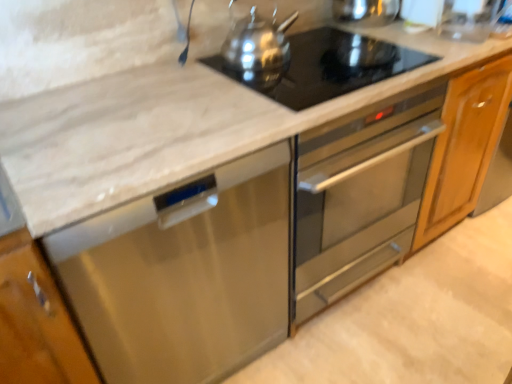
Question: From the image's perspective, is black glass cooktop at upper center located above stainless steel dishwasher at lower left?

Choices:
 (A) yes
 (B) no

Answer: (A)

Question: Can you confirm if black glass cooktop at upper center is bigger than stainless steel dishwasher at lower left?

Choices:
 (A) no
 (B) yes

Answer: (A)

Question: Is black glass cooktop at upper center further to the viewer compared to stainless steel dishwasher at lower left?

Choices:
 (A) no
 (B) yes

Answer: (B)

Question: Can you confirm if black glass cooktop at upper center is smaller than stainless steel dishwasher at lower left?

Choices:
 (A) no
 (B) yes

Answer: (B)

Question: Would you say black glass cooktop at upper center is a long distance from stainless steel dishwasher at lower left?

Choices:
 (A) yes
 (B) no

Answer: (B)

Question: In terms of width, does black glass cooktop at upper center look wider or thinner when compared to white marble cabinet at lower left?

Choices:
 (A) thin
 (B) wide

Answer: (A)

Question: Is black glass cooktop at upper center taller or shorter than white marble cabinet at lower left?

Choices:
 (A) tall
 (B) short

Answer: (B)

Question: Based on their sizes in the image, would you say black glass cooktop at upper center is bigger or smaller than white marble cabinet at lower left?

Choices:
 (A) small
 (B) big

Answer: (A)

Question: Is black glass cooktop at upper center spatially inside white marble cabinet at lower left, or outside of it?

Choices:
 (A) inside
 (B) outside

Answer: (B)

Question: Looking at their shapes, would you say white marble cabinet at lower left is wider or thinner than polished stainless steel kettle at upper center?

Choices:
 (A) thin
 (B) wide

Answer: (B)

Question: Based on their positions, is white marble cabinet at lower left located to the left or right of polished stainless steel kettle at upper center?

Choices:
 (A) right
 (B) left

Answer: (B)

Question: Is point (14, 279) positioned closer to the camera than point (286, 39)?

Choices:
 (A) closer
 (B) farther

Answer: (A)

Question: From the image's perspective, is white marble cabinet at lower left positioned above or below polished stainless steel kettle at upper center?

Choices:
 (A) above
 (B) below

Answer: (B)

Question: Considering the positions of polished stainless steel kettle at upper center and black glass cooktop at upper center in the image, is polished stainless steel kettle at upper center taller or shorter than black glass cooktop at upper center?

Choices:
 (A) tall
 (B) short

Answer: (A)

Question: In terms of width, does polished stainless steel kettle at upper center look wider or thinner when compared to black glass cooktop at upper center?

Choices:
 (A) wide
 (B) thin

Answer: (B)